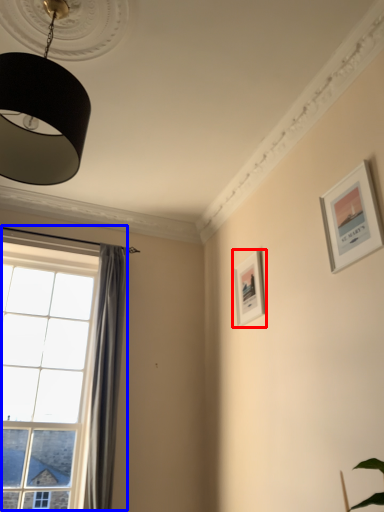
Question: Which object is closer to the camera taking this photo, picture frame (highlighted by a red box) or window (highlighted by a blue box)?

Choices:
 (A) picture frame
 (B) window

Answer: (B)